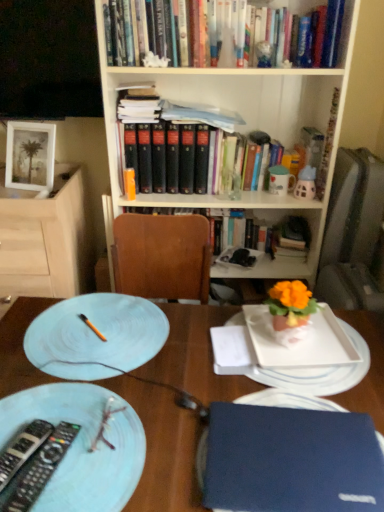
Question: Is black plastic remote control at lower left spatially inside matte ceramic mug at upper right, or outside of it?

Choices:
 (A) outside
 (B) inside

Answer: (A)

Question: Considering the positions of black plastic remote control at lower left and matte ceramic mug at upper right in the image, is black plastic remote control at lower left taller or shorter than matte ceramic mug at upper right?

Choices:
 (A) short
 (B) tall

Answer: (A)

Question: Estimate the real-world distances between objects in this image. Which object is farther from the wooden bookcase at upper center?

Choices:
 (A) blue hardcover book at lower right
 (B) matte ceramic mug at upper right
 (C) white glossy platter at center
 (D) white matte picture frame at upper left
 (E) blue matte laptop at lower right

Answer: (A)

Question: Estimate the real-world distances between objects in this image. Which object is closer to the matte ceramic mug at upper right?

Choices:
 (A) wooden bookcase at upper center
 (B) black plastic remote control at lower left
 (C) matte white plate at left
 (D) blue hardcover book at lower right
 (E) blue glossy plate at lower left, positioned as the second plate in back-to-front order

Answer: (A)